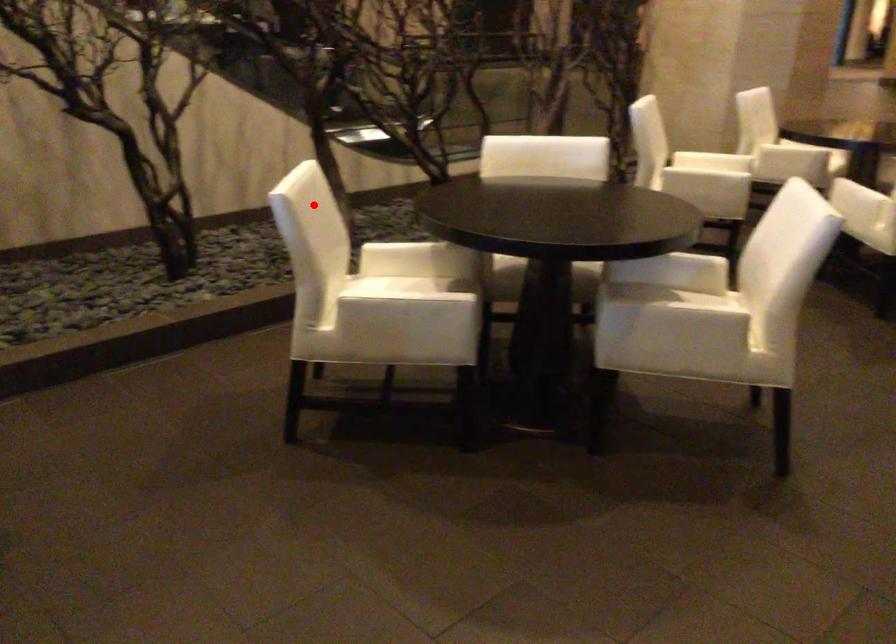
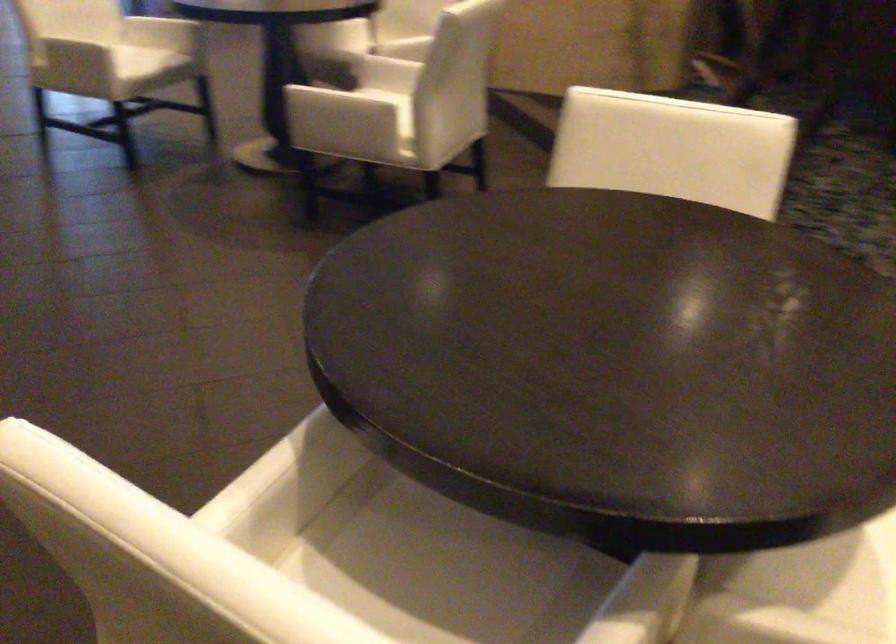
Where in the second image is the point corresponding to the highlighted location from the first image?

(673, 149)